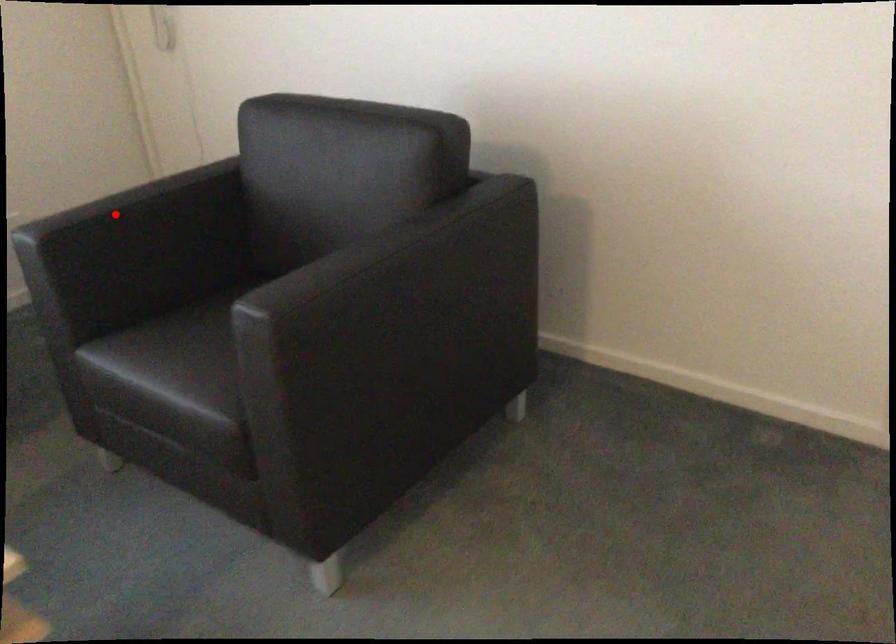
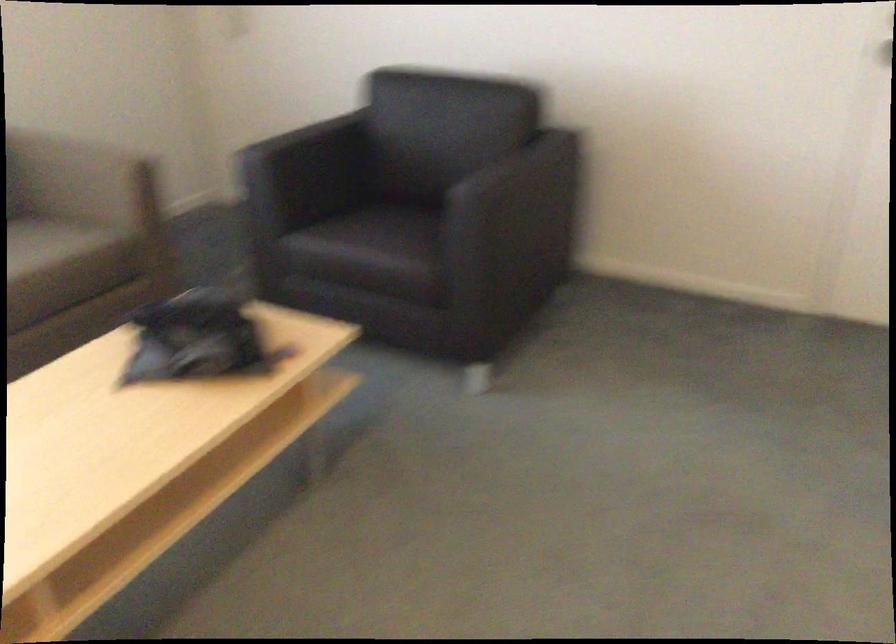
Question: I am providing you with two images of the same scene from different viewpoints. Given a red point in image1, look at the same physical point in image2. Is it:

Choices:
 (A) Closer to the viewpoint
 (B) Farther from the viewpoint

Answer: (B)